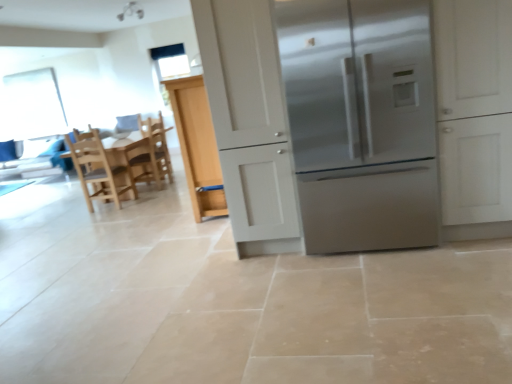
Locate an element on the screen. The image size is (512, 384). clear glass window screen at upper center, which is counted as the first window screen, starting from the front is located at coordinates click(170, 61).

Describe the element at coordinates (197, 144) in the screenshot. I see `white matte cabinet at center` at that location.

Describe the element at coordinates (154, 154) in the screenshot. Image resolution: width=512 pixels, height=384 pixels. I see `wooden chair at center, which is the first chair from back to front` at that location.

Describe the element at coordinates (98, 169) in the screenshot. Image resolution: width=512 pixels, height=384 pixels. I see `light wood chair at left, the 2th chair positioned from the back` at that location.

Identify the location of transparent plastic window screen at upper left, which appears as the 1th window screen when viewed from the left. (34, 104).

Locate an element on the screen. The height and width of the screenshot is (384, 512). stainless steel refrigerator at center is located at coordinates (361, 121).

Find the location of a particular element. The width and height of the screenshot is (512, 384). clear glass window screen at upper center, which is counted as the second window screen, starting from the back is located at coordinates coord(170,61).

From the image's perspective, would you say stainless steel refrigerator at center is shown under light wood chair at left, the 2th chair positioned from the back?

No, from the image's perspective, stainless steel refrigerator at center is not below light wood chair at left, the 2th chair positioned from the back.

Where is `chair below the stainless steel refrigerator at center (from the image's perspective)`? This screenshot has height=384, width=512. chair below the stainless steel refrigerator at center (from the image's perspective) is located at coordinates (98, 169).

Is stainless steel refrigerator at center situated inside light wood chair at left, which is the first chair in front-to-back order, or outside?

The correct answer is: outside.

Are stainless steel refrigerator at center and light wood chair at left, which is the first chair in front-to-back order, beside each other?

No, stainless steel refrigerator at center is not with light wood chair at left, which is the first chair in front-to-back order.

Can you confirm if white matte cabinet at center is positioned to the left of wooden chair at center, which is the second chair in front-to-back order?

In fact, white matte cabinet at center is to the right of wooden chair at center, which is the second chair in front-to-back order.

Which object is thinner, white matte cabinet at center or wooden chair at center, which is the second chair in front-to-back order?

With smaller width is white matte cabinet at center.

This screenshot has width=512, height=384. What are the coordinates of `cabinetry that is above the wooden chair at center, which is the first chair from back to front (from a real-world perspective)` in the screenshot? It's located at (197, 144).

Is white matte cabinet at center turned away from wooden chair at center, which is the first chair from back to front?

No, white matte cabinet at center's orientation is not away from wooden chair at center, which is the first chair from back to front.

I want to click on refrigerator above the white matte cabinet at center (from a real-world perspective), so click(x=361, y=121).

Is white matte cabinet at center spatially inside stainless steel refrigerator at center, or outside of it?

white matte cabinet at center is outside stainless steel refrigerator at center.

Which object is closer to the camera taking this photo, white matte cabinet at center or stainless steel refrigerator at center?

stainless steel refrigerator at center.

How far apart are white matte cabinet at center and stainless steel refrigerator at center?

white matte cabinet at center is 5.21 feet away from stainless steel refrigerator at center.

This screenshot has height=384, width=512. In order to click on window screen that is the 1st one when counting upward from the stainless steel refrigerator at center (from the image's perspective) in this screenshot , I will do `click(34, 104)`.

Are transparent plastic window screen at upper left, acting as the second window screen starting from the right, and stainless steel refrigerator at center located far from each other?

transparent plastic window screen at upper left, acting as the second window screen starting from the right, is far away from stainless steel refrigerator at center.

From a real-world perspective, is transparent plastic window screen at upper left, which appears as the 1th window screen when viewed from the left, above or below stainless steel refrigerator at center?

From a real-world perspective, transparent plastic window screen at upper left, which appears as the 1th window screen when viewed from the left, is physically above stainless steel refrigerator at center.

Which is behind, transparent plastic window screen at upper left, which appears as the 1th window screen when viewed from the left, or stainless steel refrigerator at center?

transparent plastic window screen at upper left, which appears as the 1th window screen when viewed from the left, is further from the camera.

The image size is (512, 384). Find the location of `refrigerator located on the right of wooden chair at center, which is the second chair in front-to-back order`. refrigerator located on the right of wooden chair at center, which is the second chair in front-to-back order is located at coordinates (361, 121).

Would you consider stainless steel refrigerator at center to be distant from wooden chair at center, which is the first chair from back to front?

Absolutely, stainless steel refrigerator at center is distant from wooden chair at center, which is the first chair from back to front.

Considering the relative positions of stainless steel refrigerator at center and wooden chair at center, which is the first chair from back to front, in the image provided, is stainless steel refrigerator at center behind wooden chair at center, which is the first chair from back to front,?

No.

Considering the relative positions of transparent plastic window screen at upper left, arranged as the 1th window screen when viewed from the back, and white matte cabinet at center in the image provided, is transparent plastic window screen at upper left, arranged as the 1th window screen when viewed from the back, behind white matte cabinet at center?

Yes.

Considering the relative sizes of transparent plastic window screen at upper left, acting as the second window screen starting from the right, and white matte cabinet at center in the image provided, is transparent plastic window screen at upper left, acting as the second window screen starting from the right, thinner than white matte cabinet at center?

Indeed, transparent plastic window screen at upper left, acting as the second window screen starting from the right, has a lesser width compared to white matte cabinet at center.

From a real-world perspective, between transparent plastic window screen at upper left, arranged as the 1th window screen when viewed from the back, and white matte cabinet at center, who is vertically higher?

transparent plastic window screen at upper left, arranged as the 1th window screen when viewed from the back.

This screenshot has height=384, width=512. There is a white matte cabinet at center. Identify the location of the 1st window screen above it (from a real-world perspective). (34, 104).

Could you tell me if light wood chair at left, which is the first chair in front-to-back order, is facing wooden chair at center, which is the second chair in front-to-back order?

Yes, light wood chair at left, which is the first chair in front-to-back order, is facing wooden chair at center, which is the second chair in front-to-back order.

Identify the location of chair above the light wood chair at left, the 2th chair positioned from the back (from a real-world perspective). (154, 154).

Considering the positions of points (87, 133) and (165, 138), is point (87, 133) farther from camera compared to point (165, 138)?

No, (87, 133) is in front of (165, 138).

Looking at this image, does light wood chair at left, which is the first chair in front-to-back order, touch wooden chair at center, which is the first chair from back to front?

They are not placed beside each other.

Identify the location of the 2nd chair positioned below the stainless steel refrigerator at center (from a real-world perspective). (98, 169).

I want to click on chair that is the 2nd object located behind the white matte cabinet at center, so click(154, 154).

When comparing their distances from stainless steel refrigerator at center, does light wood chair at left, the 2th chair positioned from the back, or wooden chair at center, which is the second chair in front-to-back order, seem closer?

light wood chair at left, the 2th chair positioned from the back, lies closer to stainless steel refrigerator at center than the other object.

From the image, which object appears to be nearer to light wood chair at left, which is the first chair in front-to-back order, white matte cabinet at center or stainless steel refrigerator at center?

white matte cabinet at center is positioned closer to the anchor light wood chair at left, which is the first chair in front-to-back order.

From the image, which object appears to be farther from white matte cabinet at center, clear glass window screen at upper center, the first window screen in the right-to-left sequence, or light wood chair at left, which is the first chair in front-to-back order?

light wood chair at left, which is the first chair in front-to-back order.

Which object lies nearer to the anchor point stainless steel refrigerator at center, light wood chair at left, the 2th chair positioned from the back, or white matte cabinet at center?

The object closer to stainless steel refrigerator at center is white matte cabinet at center.

Looking at this image, estimate the real-world distances between objects in this image. Which object is further from white matte cabinet at center, light wood chair at left, the 2th chair positioned from the back, or wooden chair at center, which is the second chair in front-to-back order?

wooden chair at center, which is the second chair in front-to-back order, is further to white matte cabinet at center.

From the image, which object appears to be farther from transparent plastic window screen at upper left, the second window screen positioned from the front, clear glass window screen at upper center, which is counted as the first window screen, starting from the front, or white matte cabinet at center?

white matte cabinet at center is positioned further to the anchor transparent plastic window screen at upper left, the second window screen positioned from the front.

Which object lies nearer to the anchor point light wood chair at left, the 2th chair positioned from the back, clear glass window screen at upper center, the 2th window screen positioned from the left, or white matte cabinet at center?

white matte cabinet at center is closer to light wood chair at left, the 2th chair positioned from the back.

Consider the image. From the image, which object appears to be nearer to wooden chair at center, which is the first chair from back to front, transparent plastic window screen at upper left, arranged as the 1th window screen when viewed from the back, or light wood chair at left, the 2th chair positioned from the back?

light wood chair at left, the 2th chair positioned from the back, is positioned closer to the anchor wooden chair at center, which is the first chair from back to front.

Image resolution: width=512 pixels, height=384 pixels. Find the location of `cabinetry between stainless steel refrigerator at center and clear glass window screen at upper center, the 2th window screen positioned from the left, from front to back`. cabinetry between stainless steel refrigerator at center and clear glass window screen at upper center, the 2th window screen positioned from the left, from front to back is located at coordinates (197, 144).

Locate an element on the screen. cabinetry positioned between stainless steel refrigerator at center and transparent plastic window screen at upper left, the second window screen positioned from the front, from near to far is located at coordinates (197, 144).

At what (x,y) coordinates should I click in order to perform the action: click on window screen positioned between white matte cabinet at center and transparent plastic window screen at upper left, the second window screen positioned from the front, from near to far. Please return your answer as a coordinate pair (x, y). The image size is (512, 384). Looking at the image, I should click on (170, 61).

In order to click on window screen between stainless steel refrigerator at center and transparent plastic window screen at upper left, arranged as the 1th window screen when viewed from the back, from front to back in this screenshot , I will do `click(170, 61)`.